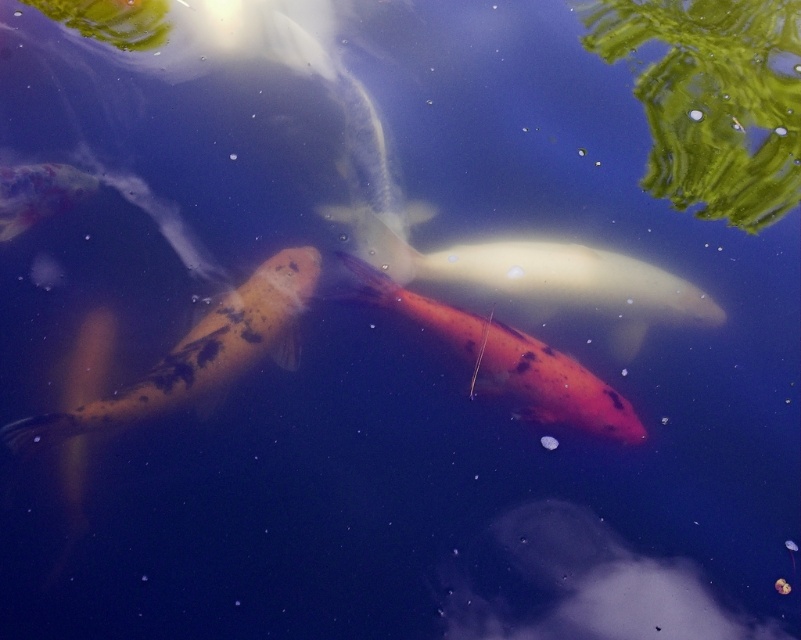
Question: Is speckled orange goldfish at center below orange matte goldfish at center?

Choices:
 (A) yes
 (B) no

Answer: (A)

Question: Which point is farther from the camera taking this photo?

Choices:
 (A) (308, 259)
 (B) (473, 352)

Answer: (A)

Question: Observing the image, what is the correct spatial positioning of speckled orange goldfish at center in reference to orange matte goldfish at center?

Choices:
 (A) below
 (B) above

Answer: (A)

Question: Which object appears closest to the camera in this image?

Choices:
 (A) speckled orange goldfish at center
 (B) orange matte goldfish at center

Answer: (A)

Question: Is speckled orange goldfish at center to the left of orange matte goldfish at center from the viewer's perspective?

Choices:
 (A) no
 (B) yes

Answer: (B)